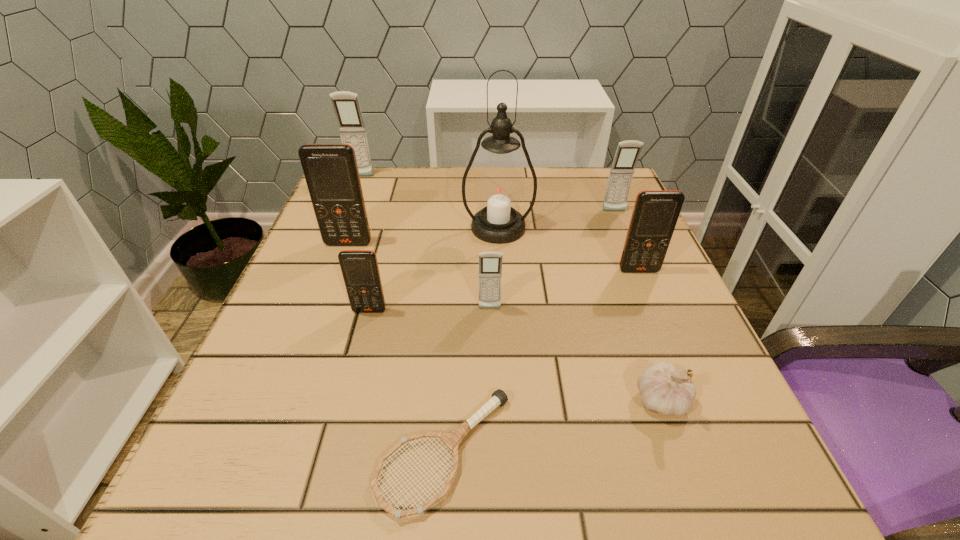
In the image, there is a desktop. At what (x,y) coordinates should I click in order to perform the action: click on vacant space at the far edge. Please return your answer as a coordinate pair (x, y). Looking at the image, I should click on (471, 176).

Locate an element on the screen. The image size is (960, 540). free space at the left edge of the desktop is located at coordinates (261, 391).

Image resolution: width=960 pixels, height=540 pixels. In order to click on vacant area at the right edge of the desktop in this screenshot , I will do `click(622, 321)`.

This screenshot has height=540, width=960. What are the coordinates of `blank space at the near left corner of the desktop` in the screenshot? It's located at (272, 489).

At what (x,y) coordinates should I click in order to perform the action: click on free location at the far right corner. Please return your answer as a coordinate pair (x, y). This screenshot has height=540, width=960. Looking at the image, I should click on (574, 202).

Find the location of a particular element. free space between the second biggest orange cellular telephone and the shortest object is located at coordinates (541, 361).

Where is `free point between the biggest gray cellular telephone and the tallest object`? This screenshot has width=960, height=540. free point between the biggest gray cellular telephone and the tallest object is located at coordinates (429, 202).

I want to click on free spot between the nearest gray cellular telephone and the farthest orange cellular telephone, so click(x=420, y=276).

Where is `vacant space that's between the second biggest orange cellular telephone and the tallest object`? This screenshot has width=960, height=540. vacant space that's between the second biggest orange cellular telephone and the tallest object is located at coordinates (568, 249).

Locate an element on the screen. vacant space that's between the gray tennis racket and the smallest orange cellular telephone is located at coordinates (407, 382).